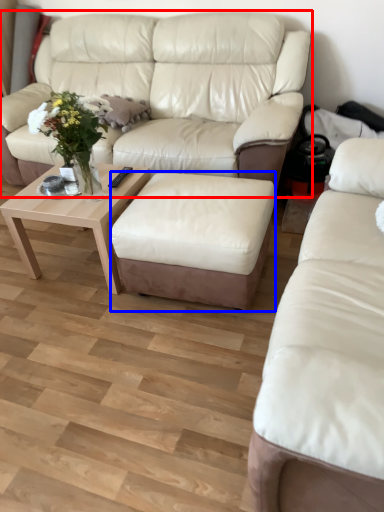
Question: Which object is further to the camera taking this photo, studio couch (highlighted by a red box) or stool (highlighted by a blue box)?

Choices:
 (A) studio couch
 (B) stool

Answer: (A)